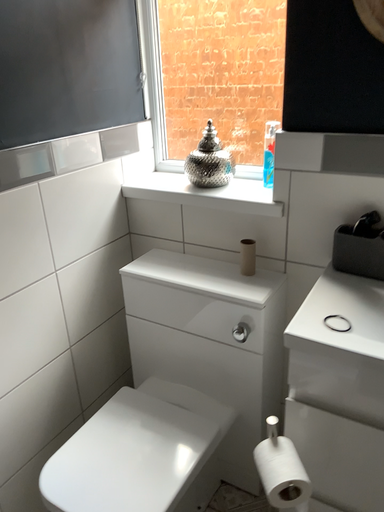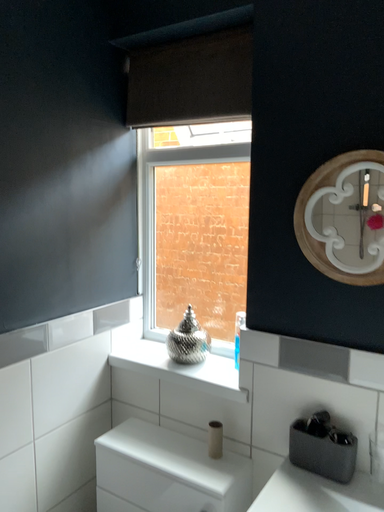
Question: Which way did the camera rotate in the video?

Choices:
 (A) rotated upward
 (B) rotated downward

Answer: (A)